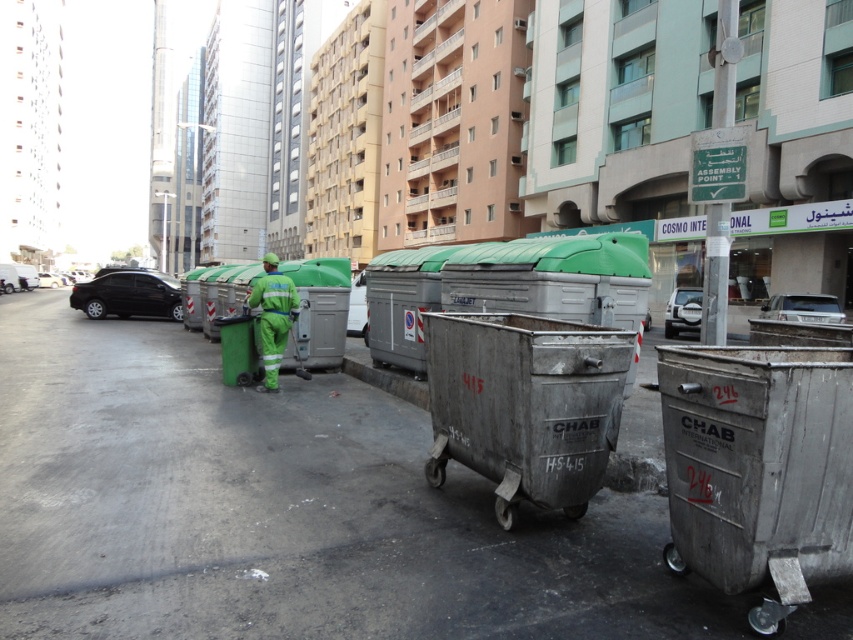
You are a sanitation worker standing next to the gray metallic trash can at right. You need to reach a small red marking on the side of the trash can to check its status. Given that your arm can extend 2.5 feet, can you comfortably reach the marking without moving the trash can?

The gray metallic trash can at right and viewer are 9.07 feet apart. Since the worker is standing next to the trash can, the distance between them is negligible, so the worker can comfortably reach the marking with their arm extended 2.5 feet.

You are a delivery person trying to park your electric scooter. You see the metallic pavement at center and the green plastic garbage at center. Which one has enough space to park your scooter on top of it?

The metallic pavement at center is bigger than the green plastic garbage at center, so the metallic pavement at center has enough space to park your scooter on top of it.

You are a delivery person with a cart that is 10 feet wide. You need to navigate through the street shown in the image. Can your cart fit between the metallic pavement at center and the green plastic garbage at center?

The metallic pavement at center and green plastic garbage at center are 15.07 feet apart, so yes, the cart can fit as the distance is greater than the cart width of 10 feet.